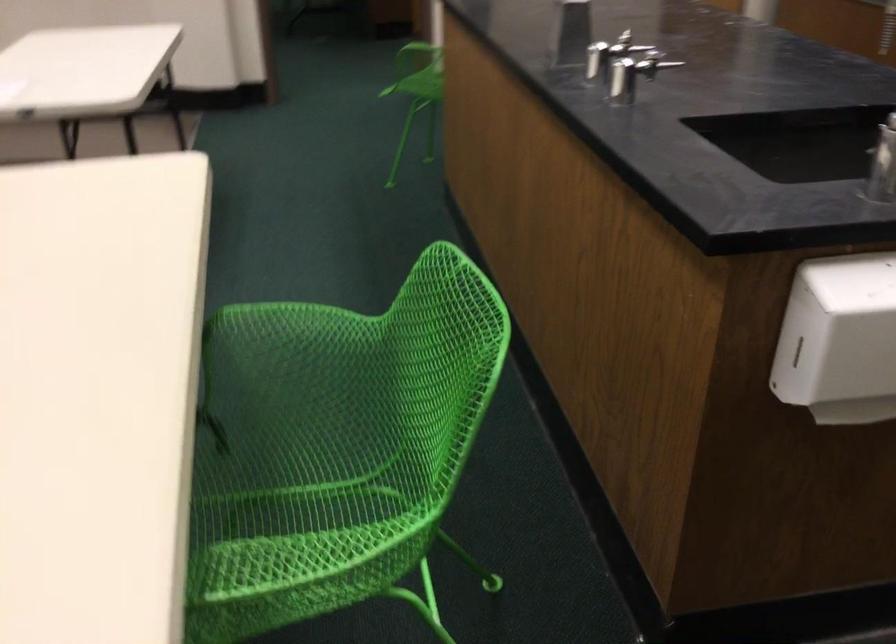
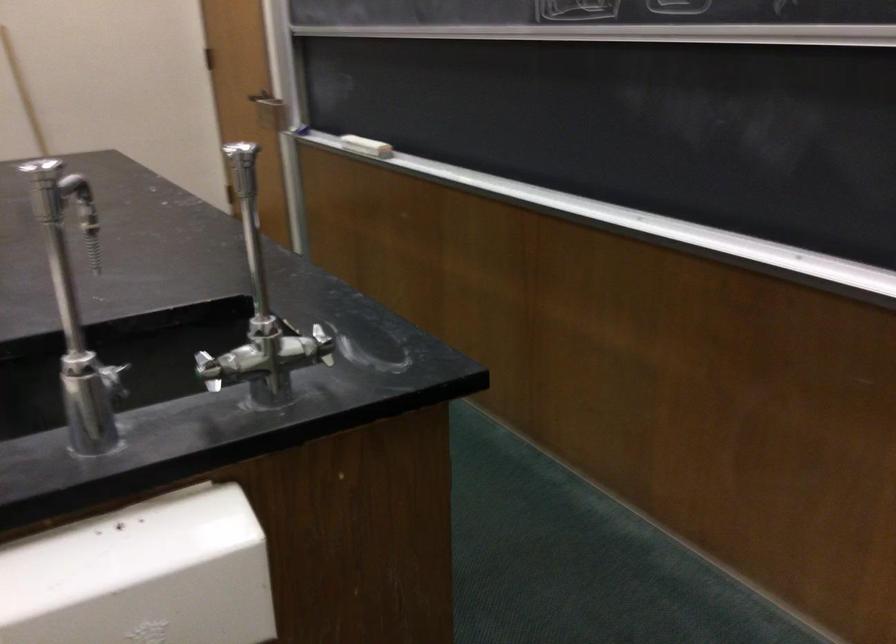
Question: In a continuous first-person perspective shot, in which direction is the camera moving?

Choices:
 (A) Left
 (B) Right
 (C) Forward
 (D) Backward

Answer: (B)